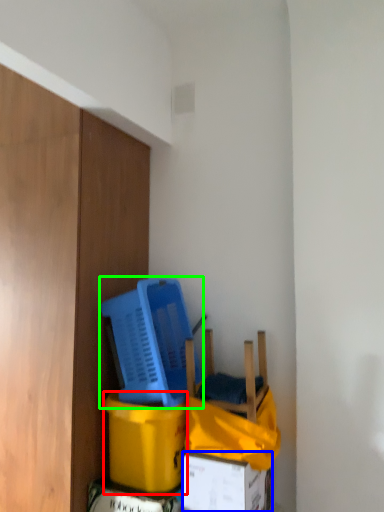
Question: Considering the real-world distances, which object is closest to cardboard box (highlighted by a red box)? box (highlighted by a blue box) or basket (highlighted by a green box).

Choices:
 (A) box
 (B) basket

Answer: (A)